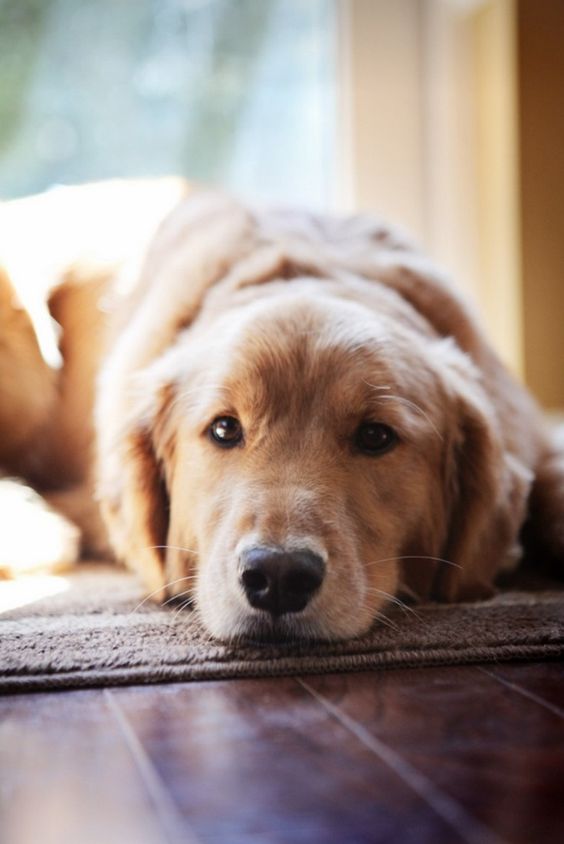
I want to click on window, so click(x=193, y=103).